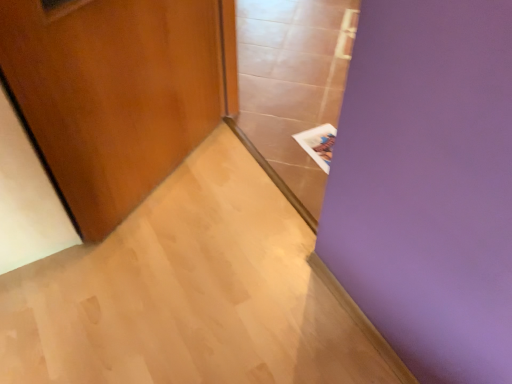
The height and width of the screenshot is (384, 512). In order to click on white paper at upper right in this screenshot , I will do (x=318, y=144).

The image size is (512, 384). In order to click on transparent glass door at center in this screenshot , I will do `click(292, 83)`.

Identify the location of wooden door at left. The width and height of the screenshot is (512, 384). (112, 94).

Where is `white paper at upper right`? This screenshot has height=384, width=512. white paper at upper right is located at coordinates (318, 144).

Considering the relative sizes of transparent glass door at center and wooden door at left in the image provided, is transparent glass door at center smaller than wooden door at left?

Incorrect, transparent glass door at center is not smaller in size than wooden door at left.

Would you say transparent glass door at center is inside or outside wooden door at left?

transparent glass door at center is outside wooden door at left.

How many degrees apart are the facing directions of transparent glass door at center and wooden door at left?

The angular difference between transparent glass door at center and wooden door at left is 124 degrees.

Based on the photo, is transparent glass door at center not close to wooden door at left?

No, there isn't a large distance between transparent glass door at center and wooden door at left.

Where is `glass door above the white paper at upper right (from the image's perspective)`? Image resolution: width=512 pixels, height=384 pixels. glass door above the white paper at upper right (from the image's perspective) is located at coordinates (292, 83).

Is transparent glass door at center facing towards white paper at upper right?

No, transparent glass door at center does not turn towards white paper at upper right.

Is white paper at upper right a part of transparent glass door at center?

No.

From a real-world perspective, is transparent glass door at center on top of white paper at upper right?

Yes, from a real-world perspective, transparent glass door at center is above white paper at upper right.

Which point is more forward, (x=328, y=151) or (x=134, y=182)?

Positioned in front is point (x=134, y=182).

Considering the relative sizes of white paper at upper right and wooden door at left in the image provided, is white paper at upper right bigger than wooden door at left?

Actually, white paper at upper right might be smaller than wooden door at left.

Would you say wooden door at left is part of white paper at upper right's contents?

No, wooden door at left is not inside white paper at upper right.

Can white paper at upper right be found inside wooden door at left?

No.

Is wooden door at left to the left of white paper at upper right from the viewer's perspective?

Yes, wooden door at left is to the left of white paper at upper right.

Which of these two, white paper at upper right or transparent glass door at center, is smaller?

With smaller size is white paper at upper right.

Locate an element on the screen. The height and width of the screenshot is (384, 512). glass door located in front of the white paper at upper right is located at coordinates (292, 83).

Based on the photo, can you confirm if white paper at upper right is wider than transparent glass door at center?

Yes.

Between wooden door at left and transparent glass door at center, which one appears on the right side from the viewer's perspective?

Result: transparent glass door at center is more to the right.

Considering the sizes of objects wooden door at left and transparent glass door at center in the image provided, who is smaller, wooden door at left or transparent glass door at center?

wooden door at left.

Considering the sizes of wooden door at left and transparent glass door at center in the image, is wooden door at left wider or thinner than transparent glass door at center?

In the image, wooden door at left appears to be more narrow than transparent glass door at center.

Where is `door below the transparent glass door at center (from a real-world perspective)`? The height and width of the screenshot is (384, 512). door below the transparent glass door at center (from a real-world perspective) is located at coordinates (112, 94).

Where is `glass door in front of the white paper at upper right`? The height and width of the screenshot is (384, 512). glass door in front of the white paper at upper right is located at coordinates (292, 83).

Which object lies further to the anchor point white paper at upper right, wooden door at left or transparent glass door at center?

wooden door at left is positioned further to the anchor white paper at upper right.

Looking at the image, which one is located closer to transparent glass door at center, wooden door at left or white paper at upper right?

The object closer to transparent glass door at center is white paper at upper right.

Estimate the real-world distances between objects in this image. Which object is closer to white paper at upper right, transparent glass door at center or wooden door at left?

transparent glass door at center is positioned closer to the anchor white paper at upper right.

Looking at the image, which one is located closer to wooden door at left, transparent glass door at center or white paper at upper right?

transparent glass door at center lies closer to wooden door at left than the other object.

From the image, which object appears to be nearer to wooden door at left, white paper at upper right or transparent glass door at center?

transparent glass door at center.

Considering their positions, is white paper at upper right positioned closer to transparent glass door at center than wooden door at left?

white paper at upper right is positioned closer to the anchor transparent glass door at center.

The width and height of the screenshot is (512, 384). Find the location of `door between transparent glass door at center and white paper at upper right in the front-back direction`. door between transparent glass door at center and white paper at upper right in the front-back direction is located at coordinates (112, 94).